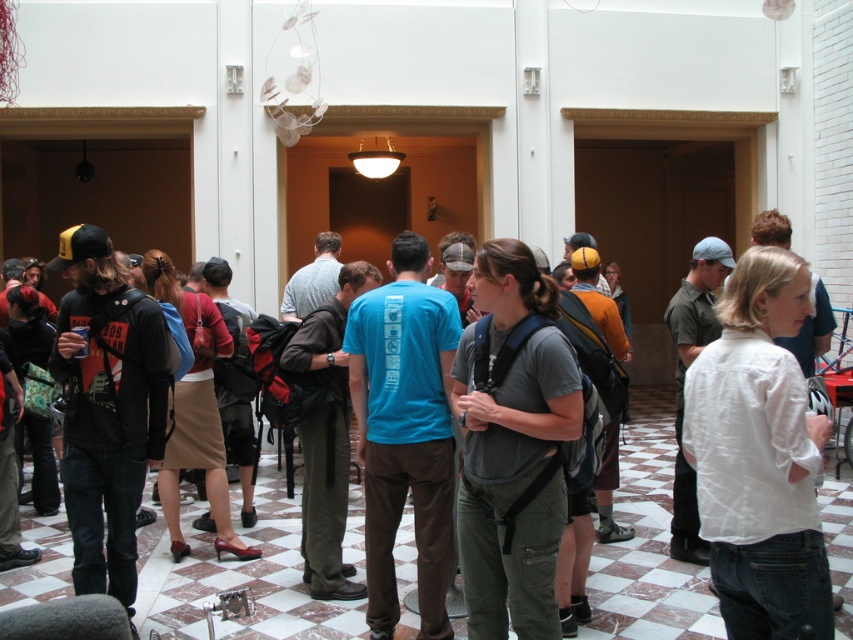
You are a person standing in the room and you see the gray fabric backpack at center and the brown fabric skirt at center. Which object is closer to the floor?

The gray fabric backpack at center is closer to the floor because it is located below the brown fabric skirt at center.

You are a photographer setting up for an event in the room. You need to decide which clothing item to focus on first based on their visibility. Since the white cotton shirt at center and brown fabric skirt at center are both at the center, which one is more likely to be seen first due to its size?

The white cotton shirt at center is thinner than the brown fabric skirt at center, so the brown fabric skirt at center will be seen first because it has a larger size.